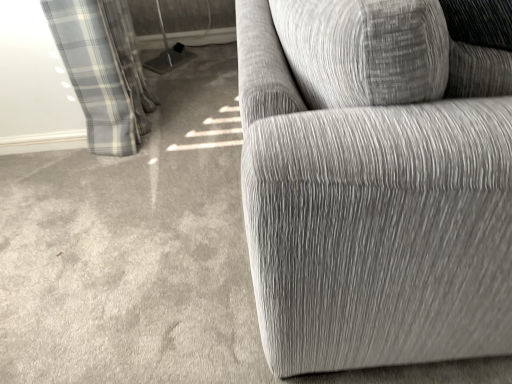
The image size is (512, 384). What do you see at coordinates (374, 184) in the screenshot? I see `textured gray fabric couch at right` at bounding box center [374, 184].

Image resolution: width=512 pixels, height=384 pixels. Identify the location of textured gray fabric couch at right. (374, 184).

What is the approximate width of textured gray fabric couch at right?

It is 18.39 inches.

This screenshot has width=512, height=384. What are the coordinates of `textured gray fabric couch at right` in the screenshot? It's located at (374, 184).